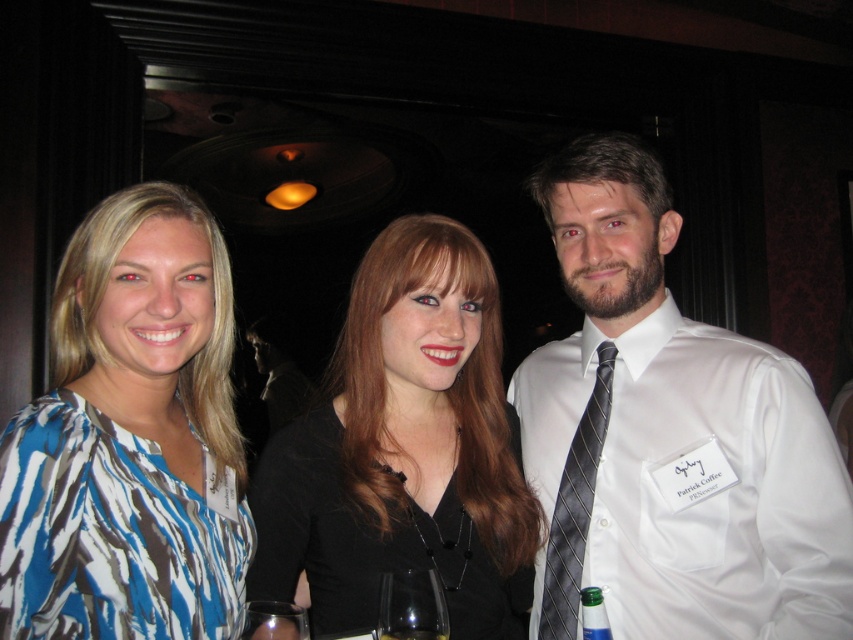
Is black matte dress at center smaller than clear glass wine glass at lower center?

No.

Is point (347, 484) more distant than point (292, 608)?

Yes.

Is point (283, 461) positioned behind point (262, 636)?

That is True.

The width and height of the screenshot is (853, 640). I want to click on black matte dress at center, so click(404, 451).

Does point (486, 289) come behind point (567, 570)?

That is False.

Is point (425, 512) closer to camera compared to point (567, 621)?

Yes, it is in front of point (567, 621).

The width and height of the screenshot is (853, 640). I want to click on black matte dress at center, so click(x=404, y=451).

Consider the image. Is black satin tie at right positioned behind clear glass wine glass at center?

That is True.

Is black satin tie at right below clear glass wine glass at center?

Incorrect, black satin tie at right is not positioned below clear glass wine glass at center.

Where is `black satin tie at right`? This screenshot has width=853, height=640. black satin tie at right is located at coordinates (x=575, y=508).